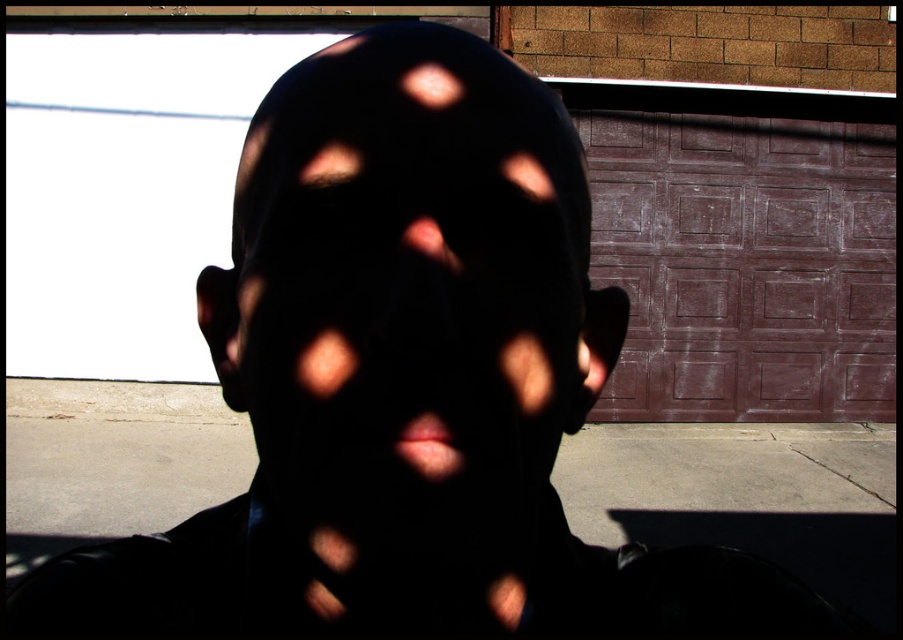
Is point (513, 352) closer to camera compared to point (808, 301)?

That is True.

Between point (347, 168) and point (641, 364), which one is positioned in front?

Point (347, 168)

Between point (277, 193) and point (703, 392), which one is positioned behind?

The point (703, 392) is more distant.

Image resolution: width=903 pixels, height=640 pixels. In order to click on black matte face at center in this screenshot , I will do `click(410, 291)`.